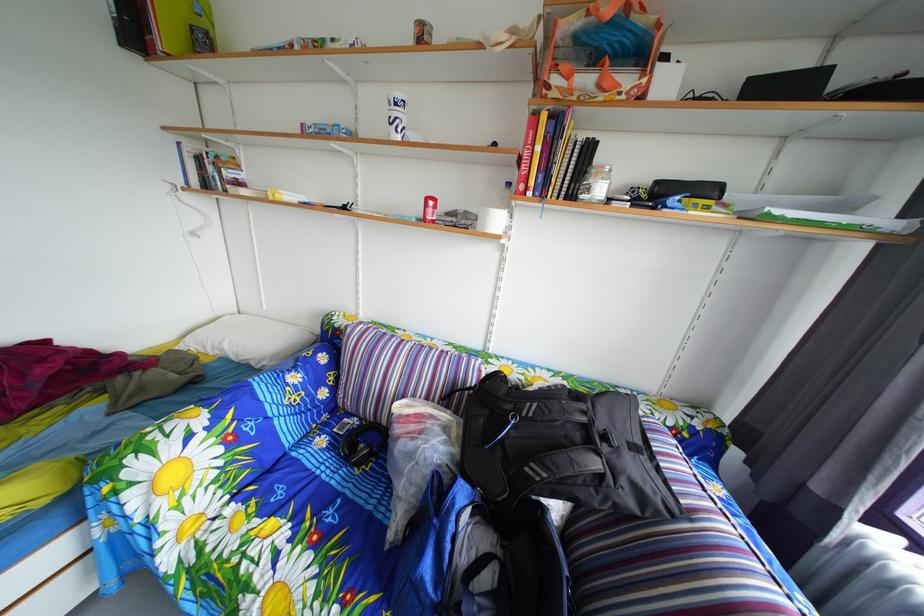
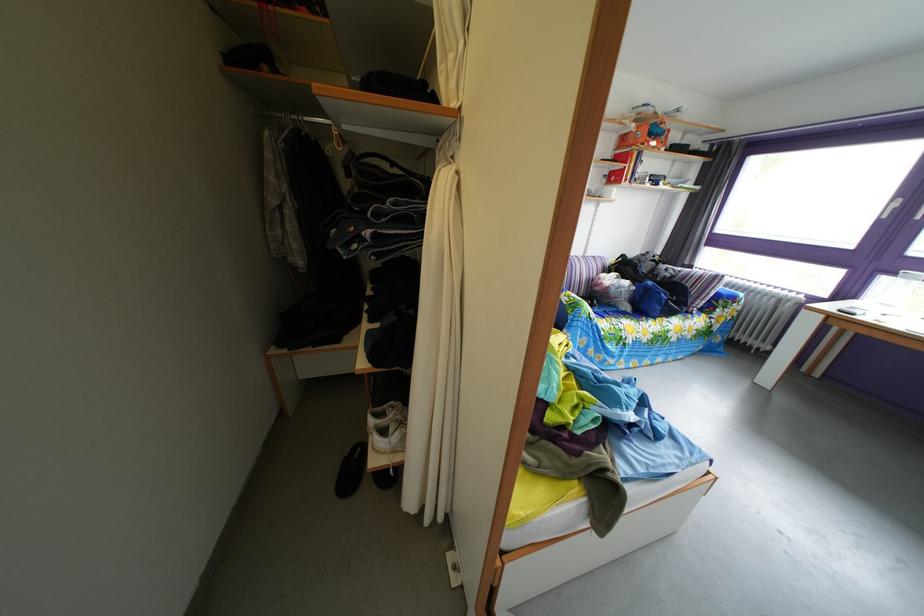
Locate, in the second image, the point that corresponds to [525,185] in the first image.

(618, 180)